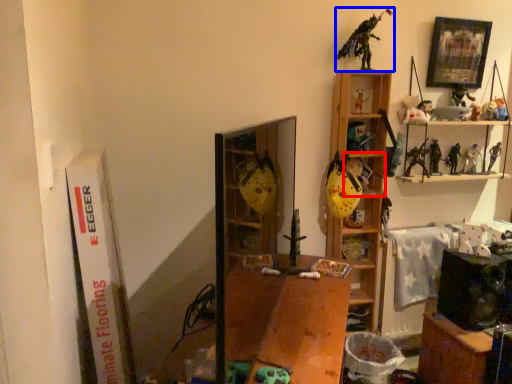
Question: Which of the following is the farthest to the observer, cabinet (highlighted by a red box) or toy (highlighted by a blue box)?

Choices:
 (A) cabinet
 (B) toy

Answer: (A)